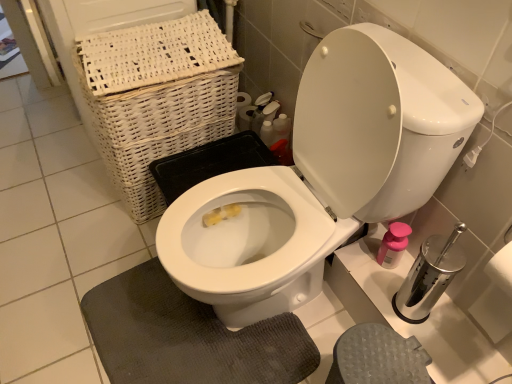
Question: Is point (170, 31) closer or farther from the camera than point (379, 253)?

Choices:
 (A) farther
 (B) closer

Answer: (A)

Question: From their relative heights in the image, would you say white wicker basket at upper left is taller or shorter than pink plastic soap dispenser at right?

Choices:
 (A) tall
 (B) short

Answer: (A)

Question: Estimate the real-world distances between objects in this image. Which object is closer to the white wicker basket at upper left?

Choices:
 (A) silver metallic toilet paper at right
 (B) white glossy toilet at center
 (C) pink plastic soap dispenser at right
 (D) gray textured bath mat at lower center

Answer: (B)

Question: Based on their relative distances, which object is nearer to the white wicker basket at upper left?

Choices:
 (A) white glossy toilet at center
 (B) pink plastic soap dispenser at right
 (C) gray textured bath mat at lower center
 (D) silver metallic toilet paper at right

Answer: (A)